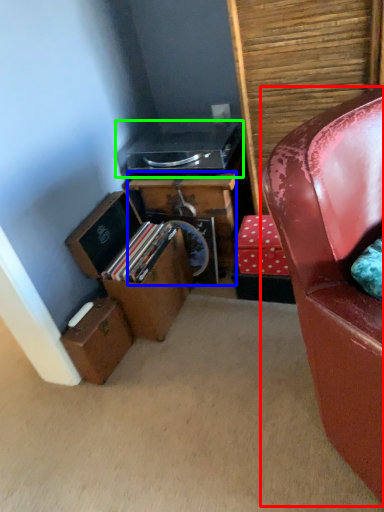
Question: Which object is the farthest from chair (highlighted by a red box)? Choose among these: desk (highlighted by a blue box) or stereo (highlighted by a green box).

Choices:
 (A) desk
 (B) stereo

Answer: (B)